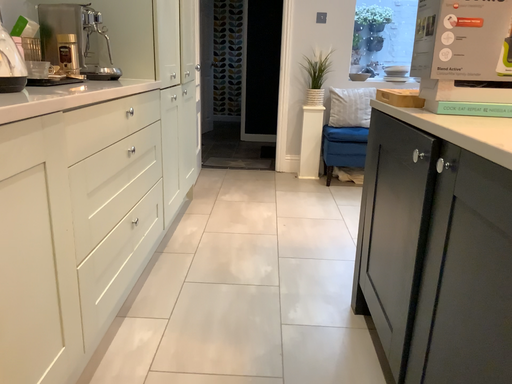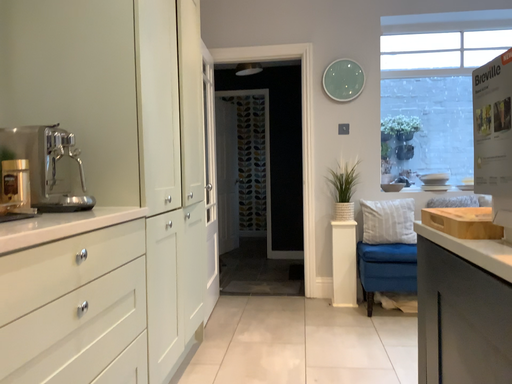
Question: Which way did the camera rotate in the video?

Choices:
 (A) rotated downward
 (B) rotated upward

Answer: (B)